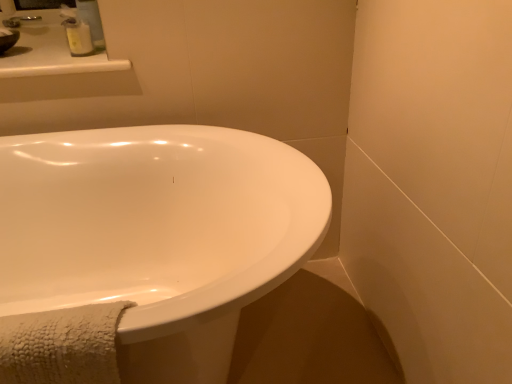
Question: From a real-world perspective, is matte white sink at upper left on white glossy bathtub at lower left?

Choices:
 (A) no
 (B) yes

Answer: (B)

Question: Is matte white sink at upper left bigger than white glossy bathtub at lower left?

Choices:
 (A) yes
 (B) no

Answer: (B)

Question: Can you confirm if matte white sink at upper left is positioned to the left of white glossy bathtub at lower left?

Choices:
 (A) yes
 (B) no

Answer: (A)

Question: From a real-world perspective, is matte white sink at upper left located beneath white glossy bathtub at lower left?

Choices:
 (A) yes
 (B) no

Answer: (B)

Question: Is matte white sink at upper left further to camera compared to white glossy bathtub at lower left?

Choices:
 (A) yes
 (B) no

Answer: (A)

Question: Relative to white plastic soap dispenser at upper left, is white glossy bathtub at lower left in front or behind?

Choices:
 (A) behind
 (B) front

Answer: (B)

Question: Considering the positions of point (182, 140) and point (89, 36), is point (182, 140) closer or farther from the camera than point (89, 36)?

Choices:
 (A) farther
 (B) closer

Answer: (B)

Question: Is white glossy bathtub at lower left wider or thinner than white plastic soap dispenser at upper left?

Choices:
 (A) thin
 (B) wide

Answer: (B)

Question: From a real-world perspective, is white glossy bathtub at lower left positioned above or below white plastic soap dispenser at upper left?

Choices:
 (A) above
 (B) below

Answer: (B)

Question: Considering the positions of point (74, 51) and point (10, 36), is point (74, 51) closer or farther from the camera than point (10, 36)?

Choices:
 (A) closer
 (B) farther

Answer: (A)

Question: In terms of width, does white plastic soap dispenser at upper left look wider or thinner when compared to matte white sink at upper left?

Choices:
 (A) thin
 (B) wide

Answer: (A)

Question: Is white plastic soap dispenser at upper left taller or shorter than matte white sink at upper left?

Choices:
 (A) tall
 (B) short

Answer: (A)

Question: In terms of size, does white plastic soap dispenser at upper left appear bigger or smaller than matte white sink at upper left?

Choices:
 (A) big
 (B) small

Answer: (B)

Question: From a real-world perspective, is white plastic soap dispenser at upper left physically located above or below white glossy bathtub at lower left?

Choices:
 (A) above
 (B) below

Answer: (A)

Question: From the image's perspective, relative to white glossy bathtub at lower left, is white plastic soap dispenser at upper left above or below?

Choices:
 (A) above
 (B) below

Answer: (A)